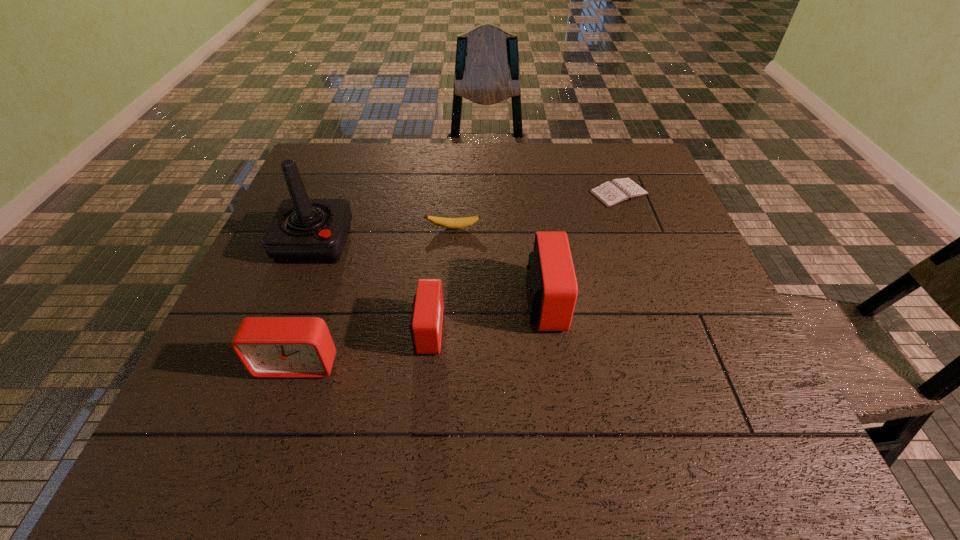
At what (x,y) coordinates should I click in order to perform the action: click on free location located 0.180m on the front-facing side of the rightmost alarm clock. Please return your answer as a coordinate pair (x, y). Looking at the image, I should click on (647, 303).

This screenshot has width=960, height=540. I want to click on free location located 0.110m on the front-facing side of the joystick, so (x=292, y=302).

You are a GUI agent. You are given a task and a screenshot of the screen. Output one action in this format:
    pyautogui.click(x=<x>, y=<y>)
    Task: Click on the free space located on the front of the diary
    The width and height of the screenshot is (960, 540).
    Given the screenshot: What is the action you would take?
    pyautogui.click(x=652, y=281)

At what (x,y) coordinates should I click in order to perform the action: click on free space located 0.220m on the right of the banana. Please return your answer as a coordinate pair (x, y). The height and width of the screenshot is (540, 960). Looking at the image, I should click on (568, 228).

In order to click on object that is at the far edge in this screenshot , I will do `click(617, 191)`.

Locate an element on the screen. object that is positioned at the near edge is located at coordinates (269, 347).

The height and width of the screenshot is (540, 960). Identify the location of alarm clock situated at the left edge. (269, 347).

I want to click on joystick situated at the left edge, so click(x=303, y=230).

Where is `object situated at the right edge`? object situated at the right edge is located at coordinates (617, 191).

The height and width of the screenshot is (540, 960). Find the location of `object located at the near left corner`. object located at the near left corner is located at coordinates (269, 347).